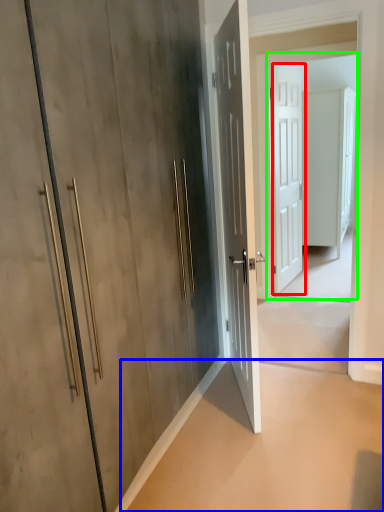
Question: Based on their relative distances, which object is nearer to door (highlighted by a red box)? Choose from concrete (highlighted by a blue box) and screen door (highlighted by a green box).

Choices:
 (A) concrete
 (B) screen door

Answer: (B)